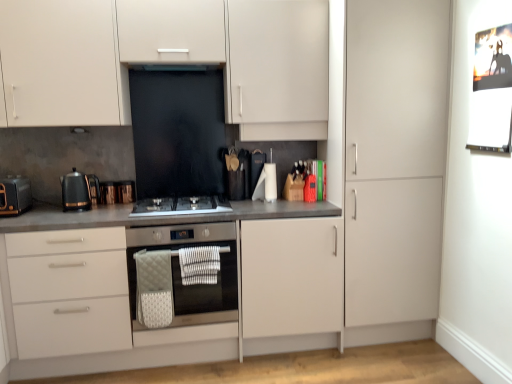
I want to click on vacant area on top of white textured cloth at lower center (from a real-world perspective), so click(199, 242).